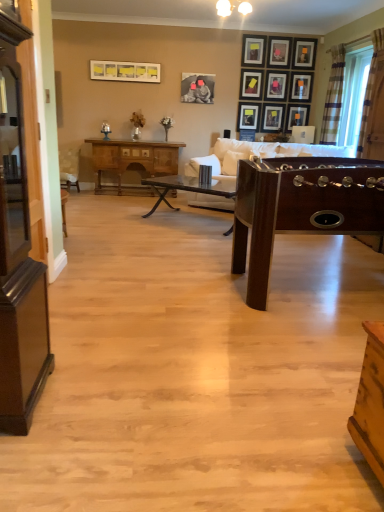
Question: Can you confirm if mahogany wood foosball table at right, which is the 3th table in back-to-front order, is shorter than matte black picture frame at upper right, marked as the 11th picture frame in a left-to-right arrangement?

Choices:
 (A) no
 (B) yes

Answer: (A)

Question: Is mahogany wood foosball table at right, which is the 3th table in back-to-front order, placed right next to matte black picture frame at upper right, marked as the 11th picture frame in a left-to-right arrangement?

Choices:
 (A) yes
 (B) no

Answer: (B)

Question: Does mahogany wood foosball table at right, positioned as the 1th table in front-to-back order, turn towards matte black picture frame at upper right, the first picture frame from the right?

Choices:
 (A) no
 (B) yes

Answer: (A)

Question: From the image's perspective, is mahogany wood foosball table at right, positioned as the 1th table in front-to-back order, under matte black picture frame at upper right, the first picture frame from the right?

Choices:
 (A) no
 (B) yes

Answer: (B)

Question: From the image's perspective, is mahogany wood foosball table at right, positioned as the 1th table in front-to-back order, located above matte black picture frame at upper right, the first picture frame from the right?

Choices:
 (A) yes
 (B) no

Answer: (B)

Question: From their relative heights in the image, would you say mahogany wood foosball table at right, which is the 3th table in back-to-front order, is taller or shorter than metallic glass coffee table at center, which is counted as the second table, starting from the front?

Choices:
 (A) short
 (B) tall

Answer: (B)

Question: From a real-world perspective, is mahogany wood foosball table at right, which is the 3th table in back-to-front order, physically located above or below metallic glass coffee table at center, which is counted as the second table, starting from the front?

Choices:
 (A) above
 (B) below

Answer: (A)

Question: Is point (269, 173) closer or farther from the camera than point (233, 195)?

Choices:
 (A) farther
 (B) closer

Answer: (B)

Question: Relative to metallic glass coffee table at center, which is counted as the second table, starting from the front, is mahogany wood foosball table at right, positioned as the 1th table in front-to-back order, in front or behind?

Choices:
 (A) front
 (B) behind

Answer: (A)

Question: From a real-world perspective, is matte yellow picture frame at upper center, which appears as the eleventh picture frame when viewed from the right, positioned above or below wooden picture frame at upper center, marked as the 10th picture frame in a left-to-right arrangement?

Choices:
 (A) below
 (B) above

Answer: (B)

Question: Considering the positions of matte yellow picture frame at upper center, which appears as the eleventh picture frame when viewed from the right, and wooden picture frame at upper center, positioned as the 2th picture frame in right-to-left order, in the image, is matte yellow picture frame at upper center, which appears as the eleventh picture frame when viewed from the right, taller or shorter than wooden picture frame at upper center, positioned as the 2th picture frame in right-to-left order,?

Choices:
 (A) short
 (B) tall

Answer: (A)

Question: From the image's perspective, is matte yellow picture frame at upper center, which appears as the eleventh picture frame when viewed from the right, located above or below wooden picture frame at upper center, positioned as the 2th picture frame in right-to-left order?

Choices:
 (A) below
 (B) above

Answer: (B)

Question: Is point (127, 66) positioned closer to the camera than point (294, 84)?

Choices:
 (A) closer
 (B) farther

Answer: (A)

Question: Looking at the image, does wooden picture frame at upper center, marked as the 10th picture frame in a left-to-right arrangement, seem bigger or smaller compared to matte black picture frame at center, the 2th picture frame from the left?

Choices:
 (A) small
 (B) big

Answer: (A)

Question: Would you say wooden picture frame at upper center, marked as the 10th picture frame in a left-to-right arrangement, is to the left or to the right of matte black picture frame at center, which is counted as the tenth picture frame, starting from the right, in the picture?

Choices:
 (A) right
 (B) left

Answer: (A)